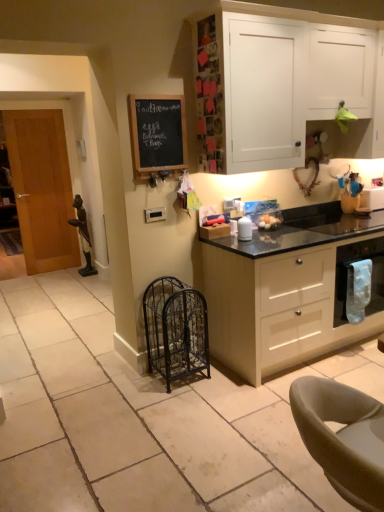
Question: From a real-world perspective, relative to black granite countertop at center, is wooden door at left vertically above or below?

Choices:
 (A) above
 (B) below

Answer: (A)

Question: Is point (71, 243) positioned closer to the camera than point (180, 483)?

Choices:
 (A) farther
 (B) closer

Answer: (A)

Question: Which of these objects is positioned farthest from the beige matte cabinet at center, the second cabinetry in the top-to-bottom sequence?

Choices:
 (A) white glossy container at upper right
 (B) blue fabric towel at right
 (C) black chalkboard at upper left
 (D) wooden door at left
 (E) white matte cabinet at upper right, positioned as the second cabinetry in bottom-to-top order

Answer: (D)

Question: Estimate the real-world distances between objects in this image. Which object is closer to the black granite countertop at center?

Choices:
 (A) blue fabric towel at right
 (B) leather-like gray chair at lower right
 (C) white matte cabinet at upper right, the first cabinetry when ordered from top to bottom
 (D) beige matte cabinet at center, the second cabinetry in the top-to-bottom sequence
 (E) black chalkboard at upper left

Answer: (D)